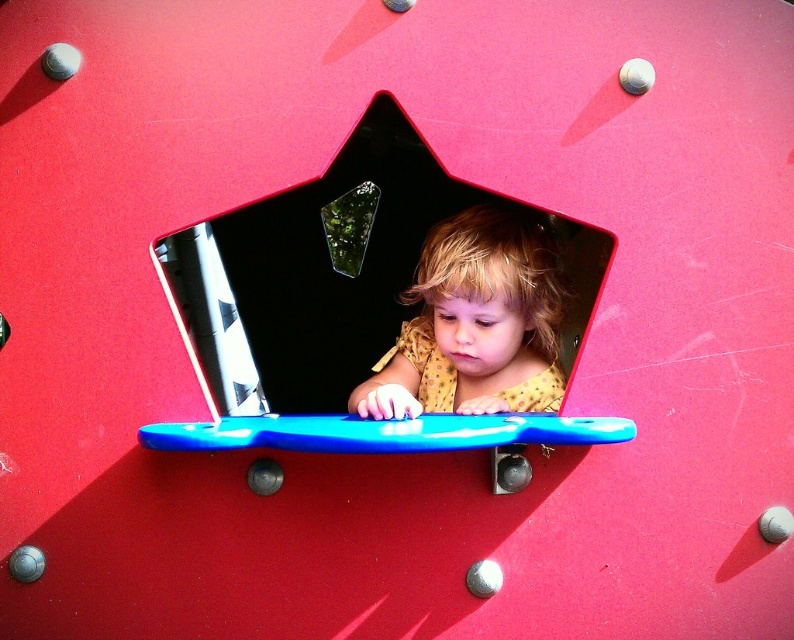
Question: Which object is farther from the camera taking this photo?

Choices:
 (A) green translucent plastic at center
 (B) matte plastic toy at center
 (C) black glossy star at center

Answer: (A)

Question: Is polka dot fabric at center closer to the viewer compared to green translucent plastic at center?

Choices:
 (A) yes
 (B) no

Answer: (A)

Question: Which of the following is the closest to the observer?

Choices:
 (A) (338, 212)
 (B) (636, 65)

Answer: (B)

Question: Which object is closer to the camera taking this photo?

Choices:
 (A) matte plastic toy at center
 (B) green translucent plastic at center
 (C) black glossy star at center
 (D) polka dot fabric at center

Answer: (C)

Question: Can you confirm if black glossy star at center is wider than matte plastic toy at center?

Choices:
 (A) yes
 (B) no

Answer: (A)

Question: Does green translucent plastic at center have a lesser width compared to matte plastic toy at center?

Choices:
 (A) yes
 (B) no

Answer: (B)